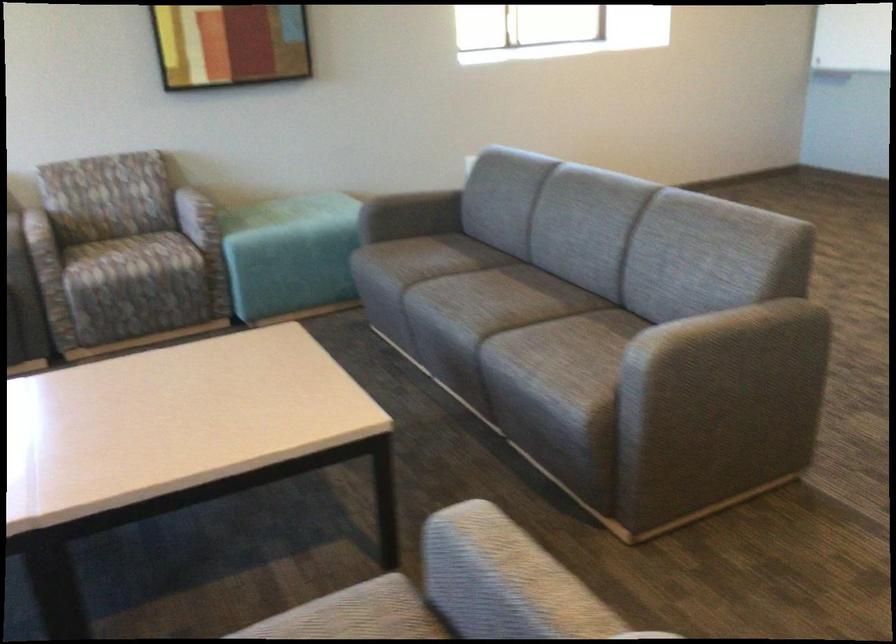
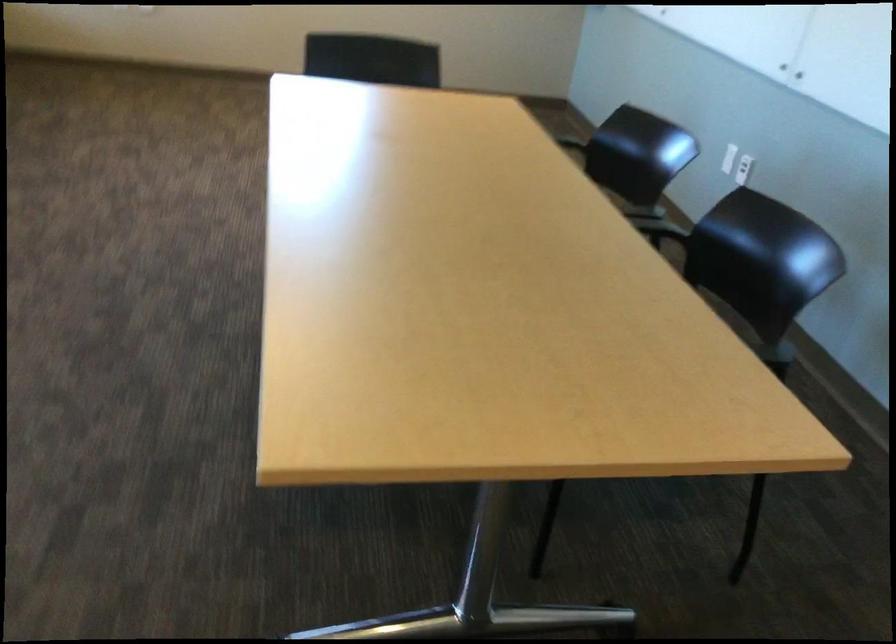
Question: In a continuous first-person perspective shot, in which direction is the camera moving?

Choices:
 (A) Left
 (B) Right
 (C) Forward
 (D) Backward

Answer: (B)